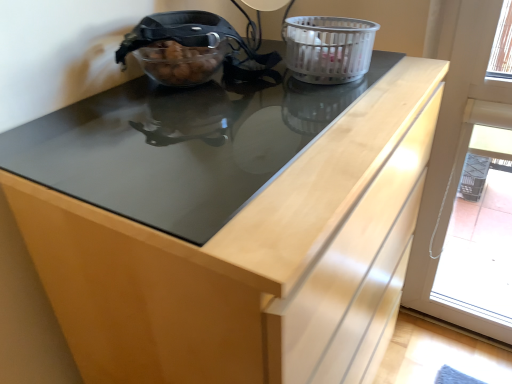
Question: Is transparent plastic screen door at right to the left or to the right of translucent plastic basket at upper right in the image?

Choices:
 (A) left
 (B) right

Answer: (B)

Question: From the image's perspective, is transparent plastic screen door at right positioned above or below translucent plastic basket at upper right?

Choices:
 (A) below
 (B) above

Answer: (A)

Question: From their relative heights in the image, would you say transparent plastic screen door at right is taller or shorter than translucent plastic basket at upper right?

Choices:
 (A) tall
 (B) short

Answer: (A)

Question: From the image's perspective, is translucent plastic basket at upper right located above or below transparent plastic screen door at right?

Choices:
 (A) above
 (B) below

Answer: (A)

Question: Is translucent plastic basket at upper right bigger or smaller than transparent plastic screen door at right?

Choices:
 (A) small
 (B) big

Answer: (A)

Question: Considering their positions, is translucent plastic basket at upper right located in front of or behind transparent plastic screen door at right?

Choices:
 (A) behind
 (B) front

Answer: (B)

Question: From a real-world perspective, is translucent plastic basket at upper right physically located above or below transparent plastic screen door at right?

Choices:
 (A) below
 (B) above

Answer: (B)